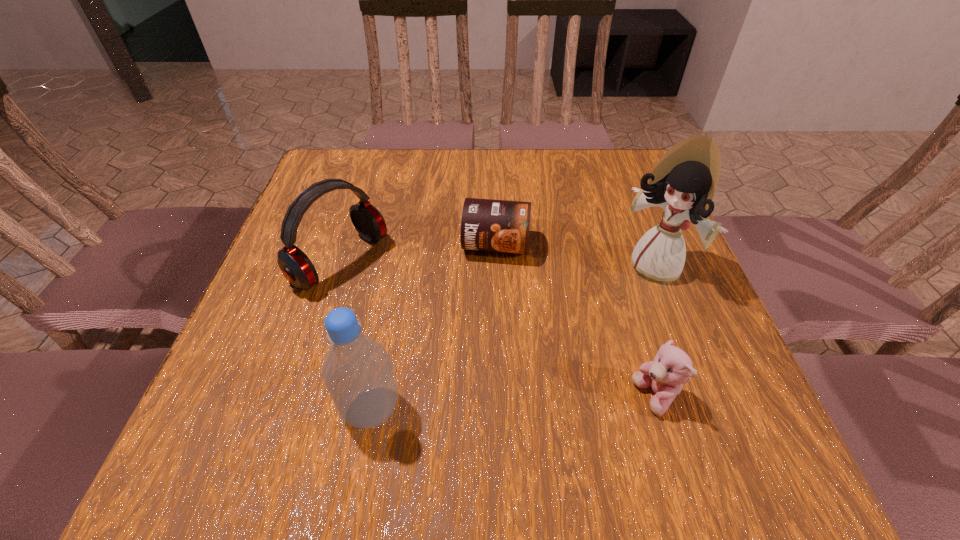
This screenshot has width=960, height=540. Identify the location of vacant spot on the desktop that is between the second tallest object and the teddy bear and is positioned on the front label of the can. (473, 404).

Locate an element on the screen. This screenshot has width=960, height=540. vacant spot on the desktop that is between the second tallest object and the teddy bear and is positioned on the ear cups of the third tallest object is located at coordinates (549, 401).

What are the coordinates of `free spot on the desktop that is between the bottle and the teddy bear and is positioned at the front face of the tallest object` in the screenshot? It's located at (516, 403).